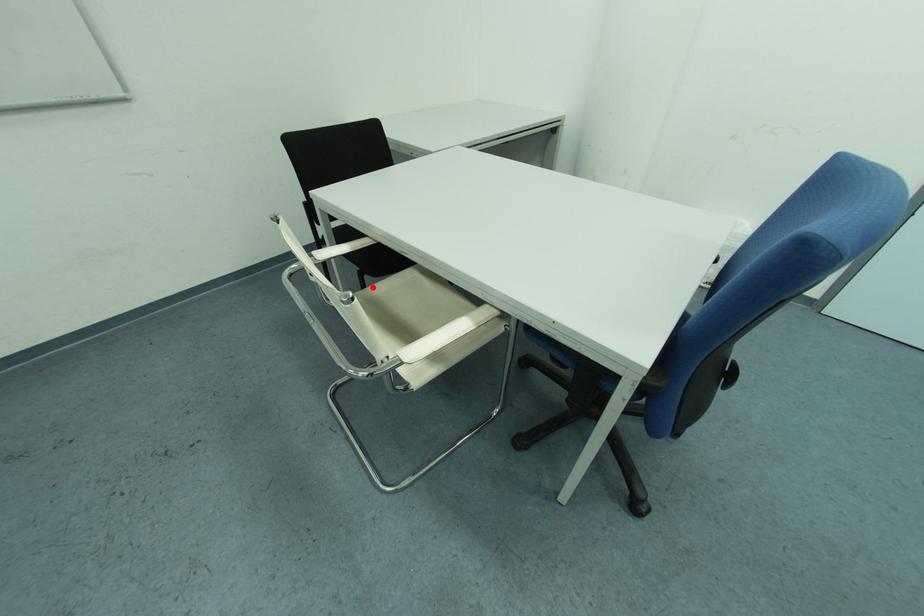
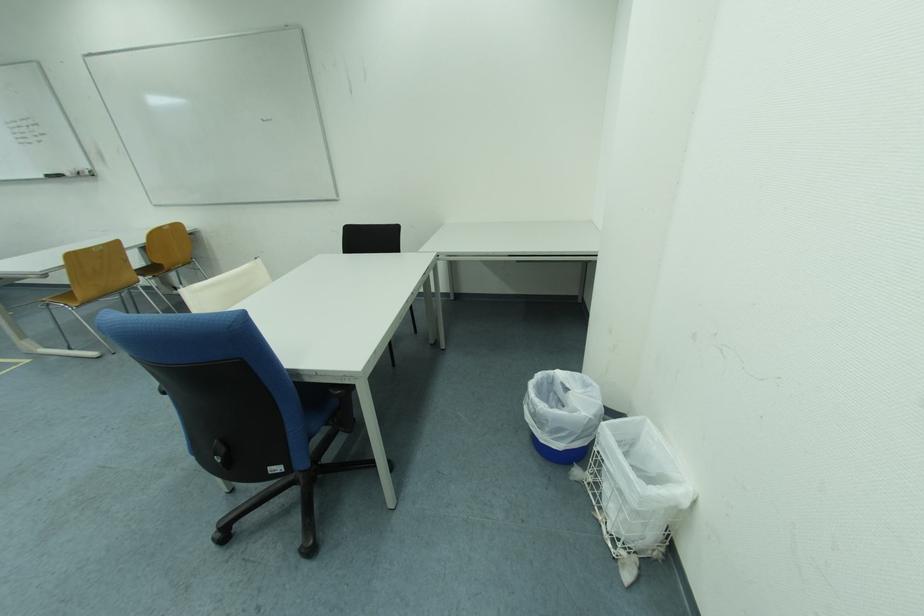
Question: I am providing you with two images of the same scene from different viewpoints. A red point is marked on the first image. Can you still see the location of the red point in image 2?

Choices:
 (A) Yes
 (B) No

Answer: (B)